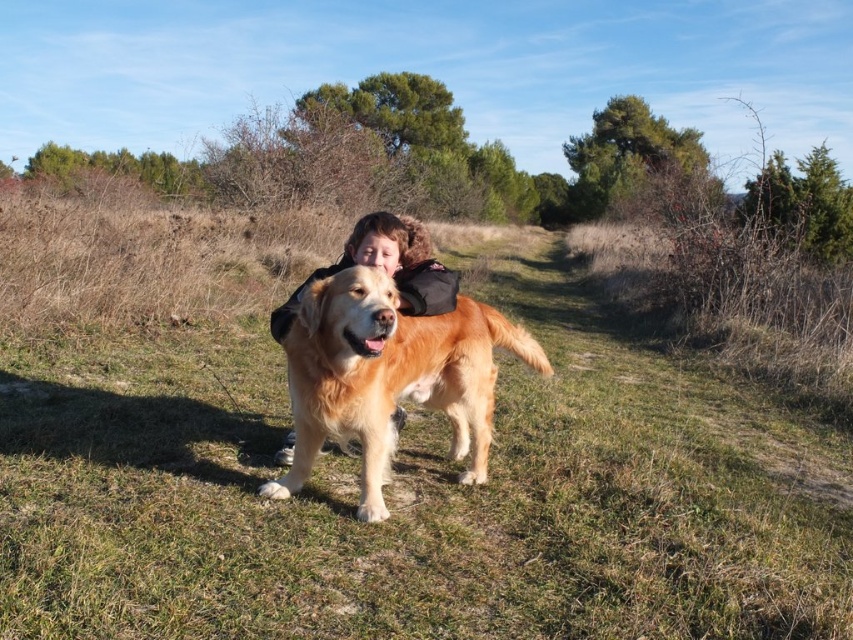
Question: Is golden fur dog at center to the left of golden hair at center from the viewer's perspective?

Choices:
 (A) no
 (B) yes

Answer: (A)

Question: In this image, where is green grassy at center located relative to golden hair at center?

Choices:
 (A) above
 (B) below

Answer: (A)

Question: Which object is closer to the camera taking this photo?

Choices:
 (A) golden fur dog at center
 (B) golden hair at center

Answer: (A)

Question: Estimate the real-world distances between objects in this image. Which object is closer to the green grassy at center?

Choices:
 (A) golden fur dog at center
 (B) golden hair at center

Answer: (A)

Question: Estimate the real-world distances between objects in this image. Which object is closer to the golden hair at center?

Choices:
 (A) green grassy at center
 (B) golden fur dog at center

Answer: (B)

Question: Is green grassy at center bigger than golden hair at center?

Choices:
 (A) no
 (B) yes

Answer: (B)